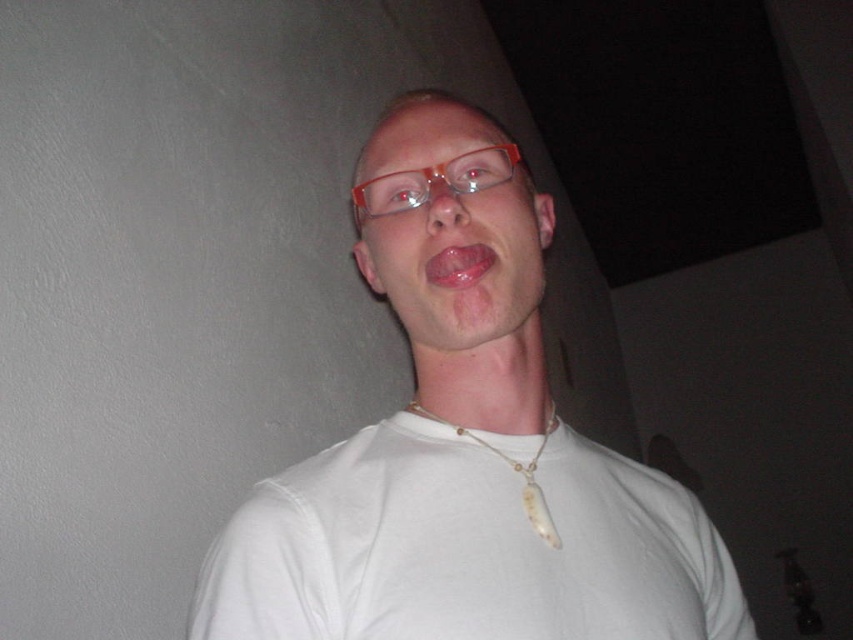
Question: Which point is closer to the camera?

Choices:
 (A) (564, 484)
 (B) (567, 636)

Answer: (B)

Question: Which point is closer to the camera?

Choices:
 (A) translucent orange glasses at center
 (B) pink glossy tongue at center
 (C) white bone necklace at center
 (D) white cotton shirt at center

Answer: (D)

Question: Among these objects, which one is farthest from the camera?

Choices:
 (A) white cotton shirt at center
 (B) matte white face at center
 (C) white matte necklace at center

Answer: (B)

Question: Is white matte necklace at center to the right of translucent orange glasses at center from the viewer's perspective?

Choices:
 (A) no
 (B) yes

Answer: (B)

Question: Can you confirm if white matte necklace at center is positioned to the left of translucent orange glasses at center?

Choices:
 (A) no
 (B) yes

Answer: (A)

Question: Is white cotton shirt at center smaller than pink glossy tongue at center?

Choices:
 (A) yes
 (B) no

Answer: (B)